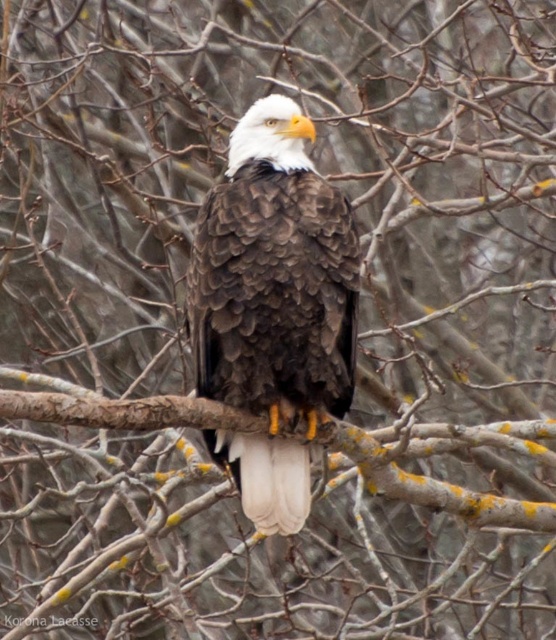
Question: Which point is farther to the camera?

Choices:
 (A) (245, 403)
 (B) (476, 433)

Answer: (B)

Question: Does dark brown feathers at center come behind brown rough tree branch at center?

Choices:
 (A) no
 (B) yes

Answer: (B)

Question: Observing the image, what is the correct spatial positioning of dark brown feathers at center in reference to brown rough tree branch at center?

Choices:
 (A) below
 (B) above

Answer: (B)

Question: Does dark brown feathers at center have a smaller size compared to brown rough tree branch at center?

Choices:
 (A) yes
 (B) no

Answer: (A)